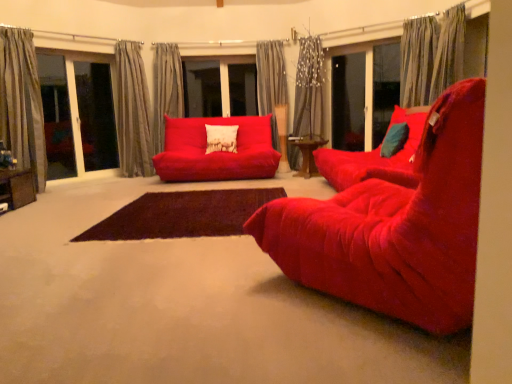
Locate an element on the screen. The width and height of the screenshot is (512, 384). vacant area situated below brown rug at center (from a real-world perspective) is located at coordinates (190, 206).